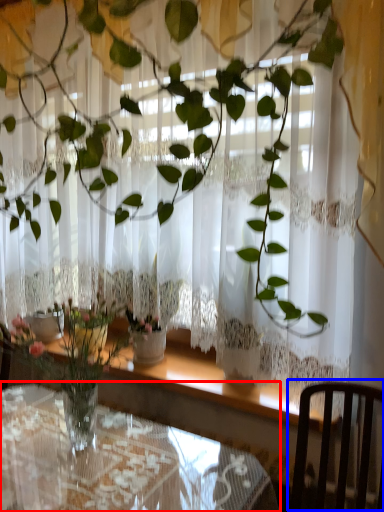
Question: Which object appears farthest to the camera in this image, table (highlighted by a red box) or chair (highlighted by a blue box)?

Choices:
 (A) table
 (B) chair

Answer: (A)